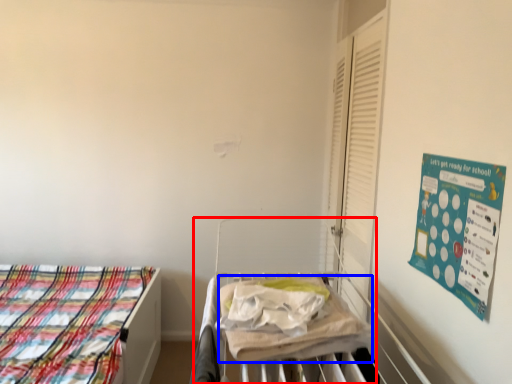
Question: Which object appears closest to the camera in this image, hospital bed (highlighted by a red box) or blanket (highlighted by a blue box)?

Choices:
 (A) hospital bed
 (B) blanket

Answer: (A)